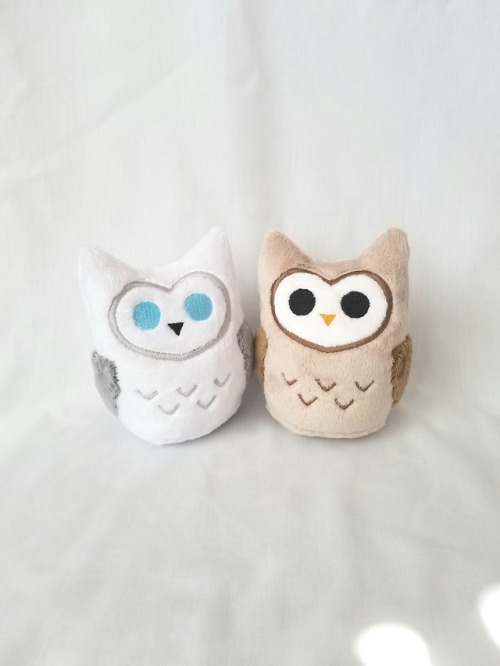
Image resolution: width=500 pixels, height=666 pixels. In order to click on tan stuffed owl in this screenshot , I will do `click(368, 375)`.